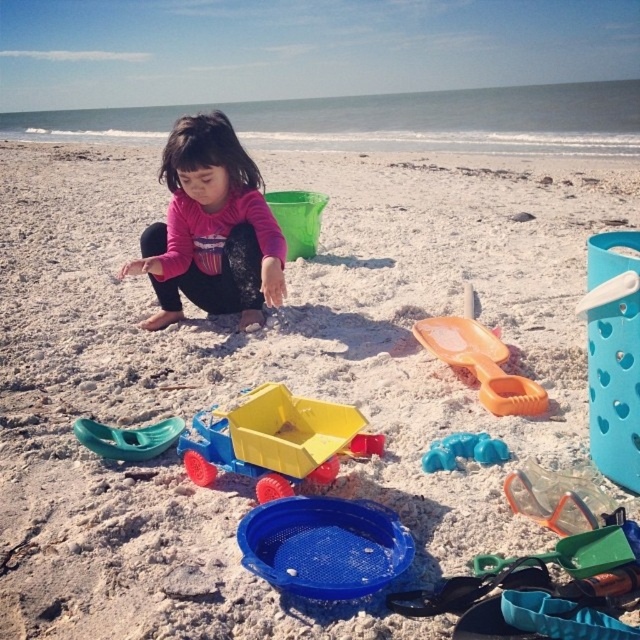
You are a parent trying to locate your child on the beach. You see the pink fabric child at center and the translucent blue plastic toy at center. Which object is closer to the left side of the image?

The pink fabric child at center is closer to the left side of the image because it is positioned to the left of the translucent blue plastic toy at center.

You are a photographer standing at the camera position. You see two points in the scene, point 1 at coordinates point (x=224, y=209) and point 2 at coordinates point (x=442, y=465). Which point is closer to your camera?

Point (x=224, y=209) is closer to the camera because it is further to the camera than point (x=442, y=465).